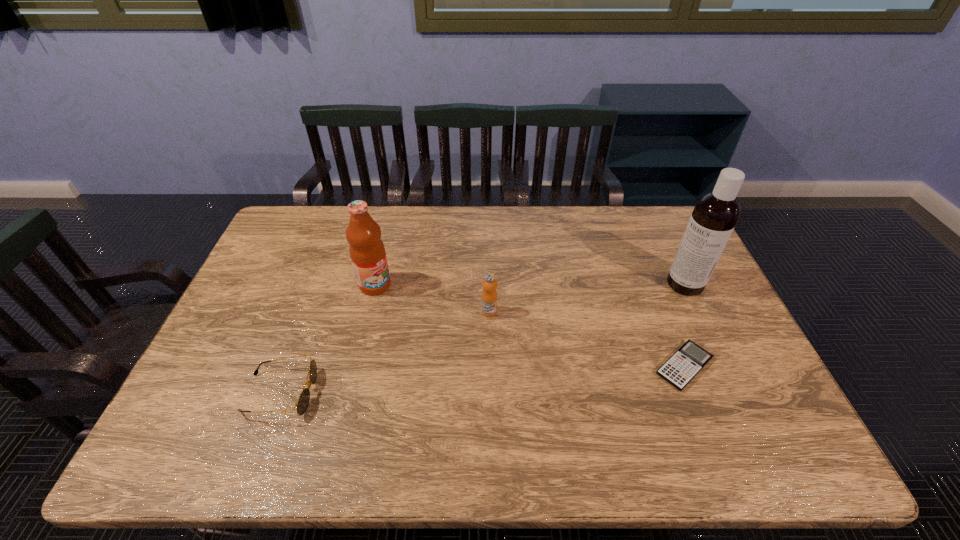
Identify the location of vacant space located on the label side of the tallest object. This screenshot has height=540, width=960. (619, 325).

Find the location of `free location located on the label side of the tallest object`. free location located on the label side of the tallest object is located at coordinates (596, 339).

Where is `vacant space situated on the label side of the tallest object`? The height and width of the screenshot is (540, 960). vacant space situated on the label side of the tallest object is located at coordinates (607, 333).

At what (x,y) coordinates should I click in order to perform the action: click on vacant space situated 0.270m on the front label of the third object from right to left. Please return your answer as a coordinate pair (x, y). Looking at the image, I should click on (542, 390).

You are a GUI agent. You are given a task and a screenshot of the screen. Output one action in this format:
    pyautogui.click(x=<x>, y=<y>)
    Task: Click on the vacant space located 0.230m on the front label of the third object from right to left
    The width and height of the screenshot is (960, 540).
    Given the screenshot: What is the action you would take?
    pyautogui.click(x=534, y=378)

I want to click on free location located 0.260m on the front label of the third object from right to left, so click(540, 387).

Find the location of a particular element. vacant region located 0.060m on the front label of the second object from left to right is located at coordinates (x=397, y=303).

At what (x,y) coordinates should I click in order to perform the action: click on free space located 0.120m on the front label of the second object from left to right. Please return your answer as a coordinate pair (x, y). The height and width of the screenshot is (540, 960). Looking at the image, I should click on [x=410, y=313].

Identify the location of free spot located on the front label of the second object from left to right. The image size is (960, 540). (428, 328).

Where is `sunglasses positioned at the near edge`? sunglasses positioned at the near edge is located at coordinates (304, 398).